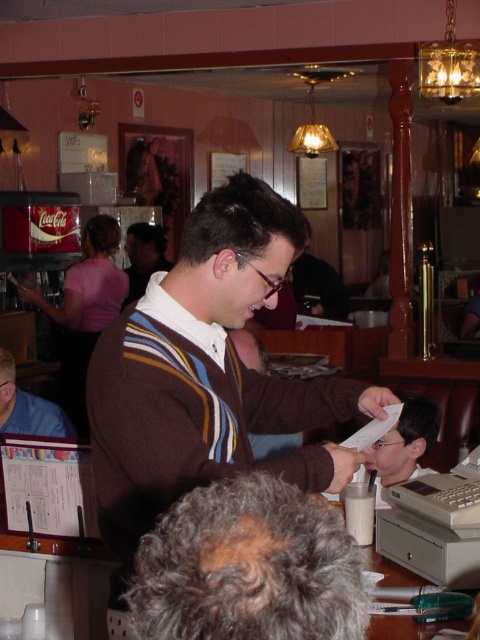
Question: Which of the following is the closest to the observer?

Choices:
 (A) (69, 326)
 (B) (149, 273)
 (C) (9, 352)

Answer: (C)

Question: Is brown striped sweater at center to the right of gray curly hair at center from the viewer's perspective?

Choices:
 (A) no
 (B) yes

Answer: (B)

Question: Which object is positioned closest to the dark brown sweater at center?

Choices:
 (A) brown striped sweater at center
 (B) gray curly hair at center
 (C) matte black soda machine at left

Answer: (A)

Question: Which object is farther from the camera taking this photo?

Choices:
 (A) brown striped sweater at center
 (B) dark brown sweater at center

Answer: (B)

Question: Can you confirm if matte black soda machine at left is smaller than dark brown sweater at center?

Choices:
 (A) yes
 (B) no

Answer: (B)

Question: Can you confirm if brown striped sweater at center is positioned to the left of brown sweater at center?

Choices:
 (A) yes
 (B) no

Answer: (B)